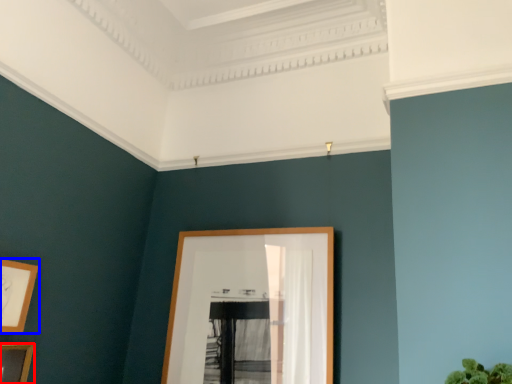
Question: Which object is closer to the camera taking this photo, picture frame (highlighted by a red box) or picture frame (highlighted by a blue box)?

Choices:
 (A) picture frame
 (B) picture frame

Answer: (A)